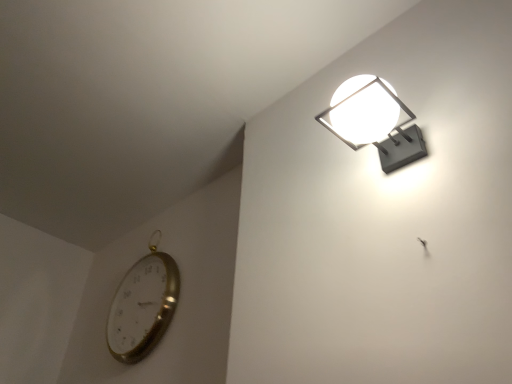
Question: From the image's perspective, is gold metallic clock at lower left located above or below matte gray wall lamp at upper right?

Choices:
 (A) above
 (B) below

Answer: (B)

Question: Is point (164, 271) closer or farther from the camera than point (352, 94)?

Choices:
 (A) closer
 (B) farther

Answer: (B)

Question: In the image, is gold metallic clock at lower left on the left side or the right side of matte gray wall lamp at upper right?

Choices:
 (A) left
 (B) right

Answer: (A)

Question: In terms of width, does matte gray wall lamp at upper right look wider or thinner when compared to gold metallic clock at lower left?

Choices:
 (A) thin
 (B) wide

Answer: (B)

Question: From the image's perspective, is matte gray wall lamp at upper right positioned above or below gold metallic clock at lower left?

Choices:
 (A) above
 (B) below

Answer: (A)

Question: From a real-world perspective, relative to gold metallic clock at lower left, is matte gray wall lamp at upper right vertically above or below?

Choices:
 (A) above
 (B) below

Answer: (B)

Question: Which is correct: matte gray wall lamp at upper right is inside gold metallic clock at lower left, or outside of it?

Choices:
 (A) inside
 (B) outside

Answer: (B)